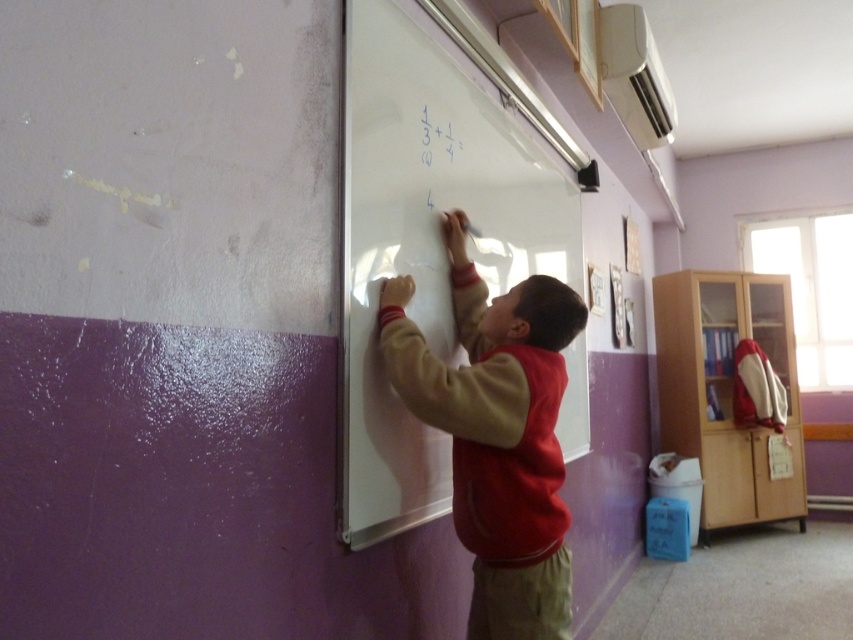
Who is higher up, whiteboard at center or red fleece vest at center?

whiteboard at center is higher up.

Is whiteboard at center smaller than red fleece vest at center?

Actually, whiteboard at center might be larger than red fleece vest at center.

Which is in front, point (550, 244) or point (509, 496)?

Point (509, 496) is in front.

Where is `whiteboard at center`? whiteboard at center is located at coordinates (424, 244).